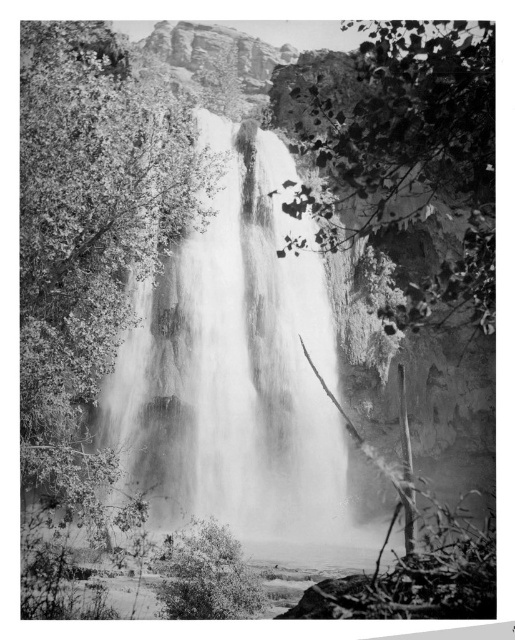
Consider the image. Is smooth green tree at center taller than leaves at center?

No, smooth green tree at center is not taller than leaves at center.

Is smooth green tree at center further to camera compared to leaves at center?

No, it is in front of leaves at center.

Which is behind, point (22, 67) or point (450, 32)?

The point (450, 32) is behind.

I want to click on smooth green tree at center, so click(x=89, y=234).

Is the position of smooth white water at center more distant than that of leaves at center?

That is False.

Which is behind, point (116, 378) or point (338, 189)?

Point (338, 189)

The width and height of the screenshot is (515, 640). What are the coordinates of `smooth white water at center` in the screenshot? It's located at (237, 380).

Between smooth white water at center and smooth green tree at center, which one appears on the right side from the viewer's perspective?

smooth white water at center

Does point (124, 483) lie in front of point (107, 84)?

Yes.

Image resolution: width=515 pixels, height=640 pixels. What do you see at coordinates (237, 380) in the screenshot? I see `smooth white water at center` at bounding box center [237, 380].

The height and width of the screenshot is (640, 515). I want to click on smooth white water at center, so click(x=237, y=380).